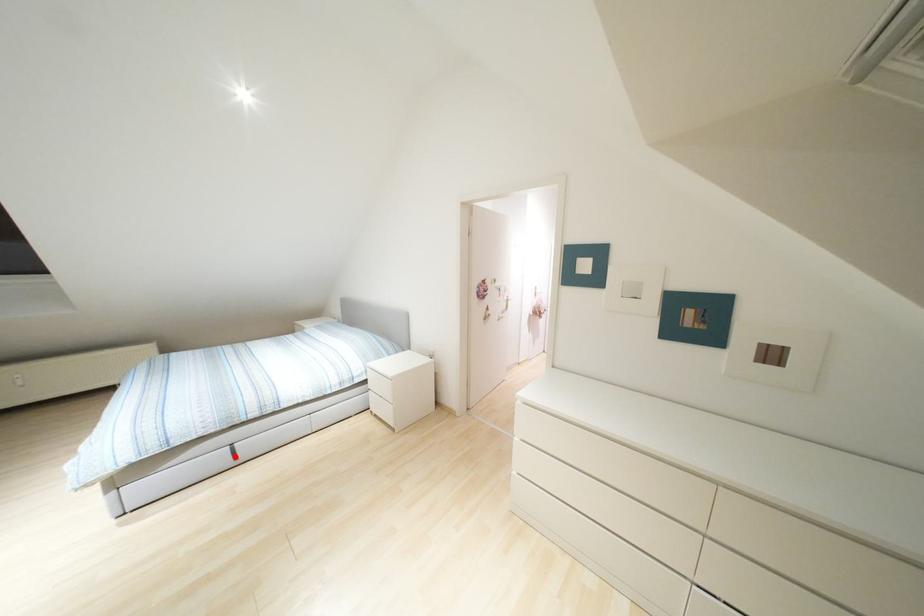
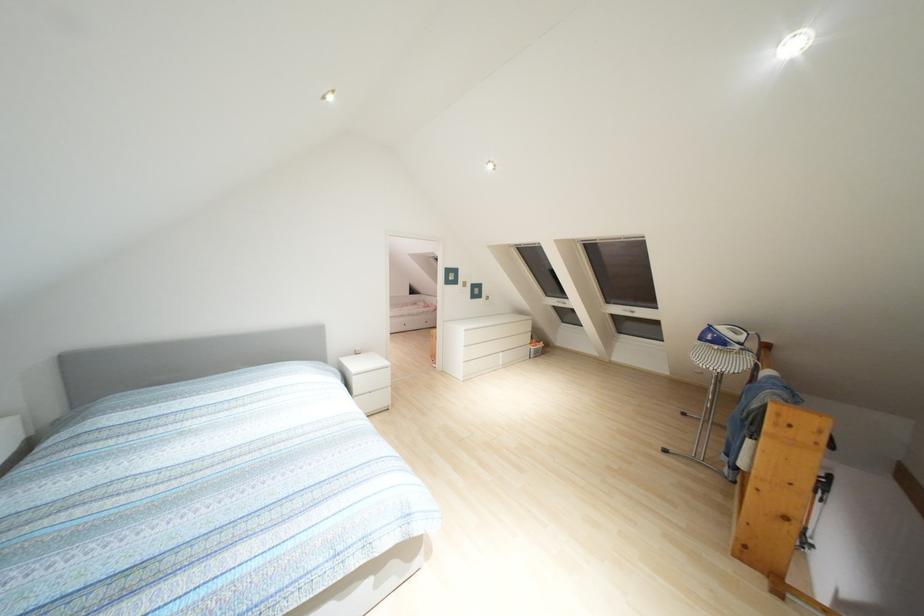
Question: I am providing you with two images of the same scene from different viewpoints. A red point is marked on the first image. Is the red point's position out of view in image 2?

Choices:
 (A) Yes
 (B) No

Answer: (A)